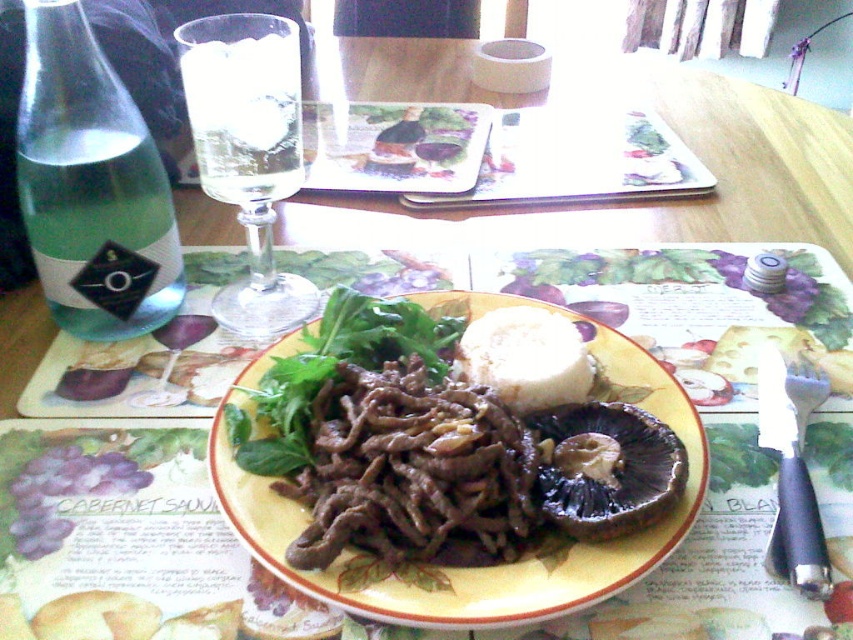
Question: Does dark brown mushroom at plate center have a lesser width compared to white creamy cheese at center?

Choices:
 (A) yes
 (B) no

Answer: (B)

Question: Can you confirm if brown glossy meat at center is positioned below green glass bottle at left?

Choices:
 (A) no
 (B) yes

Answer: (B)

Question: Which object is closer to the camera taking this photo?

Choices:
 (A) green glass bottle at left
 (B) white fluffy bread at center
 (C) silver metallic fork at lower right
 (D) brown glossy meat at center

Answer: (D)

Question: Which point appears closest to the camera in this image?

Choices:
 (A) (788, 371)
 (B) (242, 326)
 (C) (451, 422)
 (D) (639, 116)

Answer: (C)

Question: Which point is closer to the camera?

Choices:
 (A) (267, 545)
 (B) (553, 451)
 (C) (341, 182)

Answer: (A)

Question: Does green glass bottle at left come behind silver metallic fork at lower right?

Choices:
 (A) yes
 (B) no

Answer: (A)